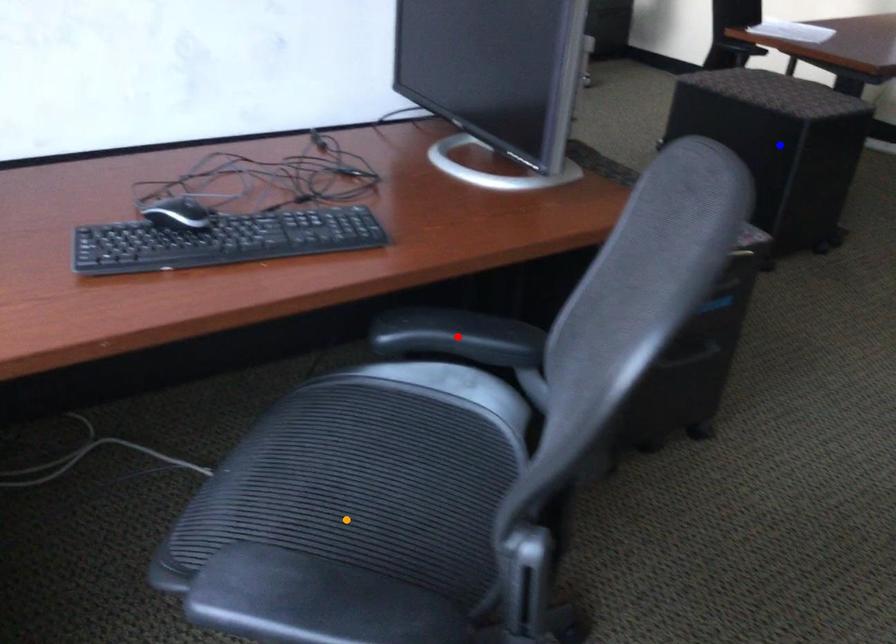
Based on the photo, order these from farthest to nearest:
- blue point
- red point
- orange point

blue point
red point
orange point